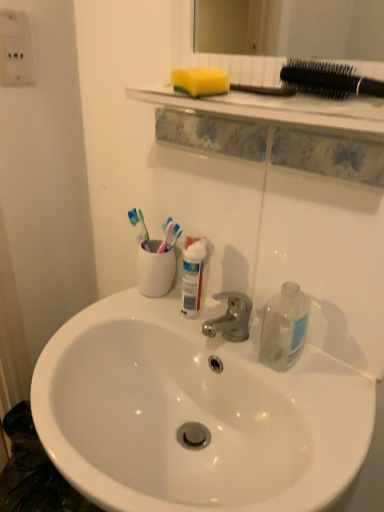
Locate an element on the screen. free space between transparent glass bottle at right and white glossy tube at center is located at coordinates (226, 332).